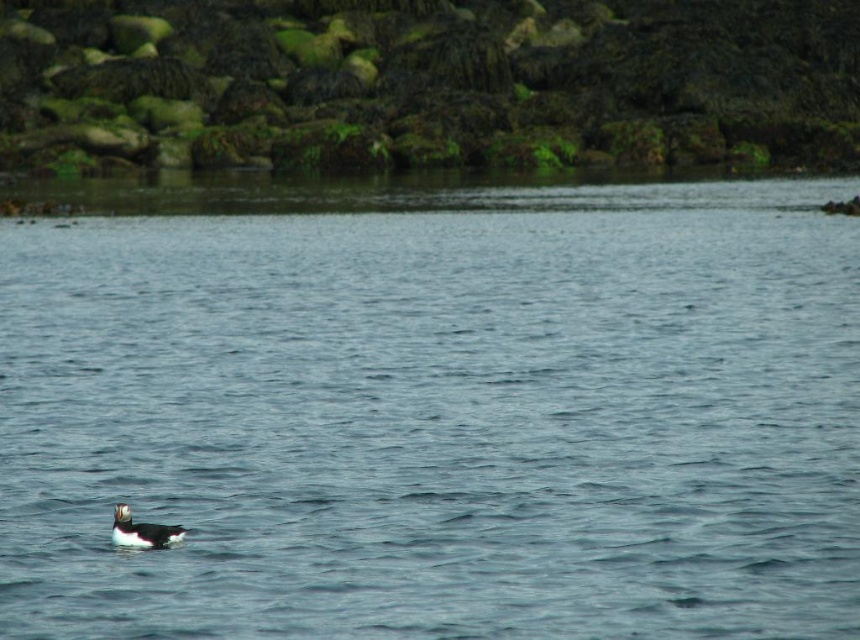
Question: Where is blue water at center located in relation to white fluffy duck at lower left in the image?

Choices:
 (A) right
 (B) left

Answer: (A)

Question: Does blue water at center have a greater width compared to white fluffy duck at lower left?

Choices:
 (A) no
 (B) yes

Answer: (B)

Question: Considering the relative positions of blue water at center and white fluffy duck at lower left in the image provided, where is blue water at center located with respect to white fluffy duck at lower left?

Choices:
 (A) right
 (B) left

Answer: (A)

Question: Which object appears farthest from the camera in this image?

Choices:
 (A) white fluffy duck at lower left
 (B) blue water at center

Answer: (A)

Question: Among these objects, which one is farthest from the camera?

Choices:
 (A) blue water at center
 (B) white fluffy duck at lower left

Answer: (B)